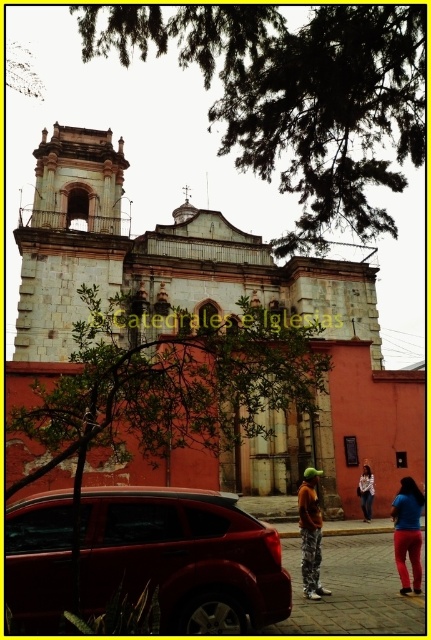
Is smooth stone church at center smaller than orange fabric pants at center?

Incorrect, smooth stone church at center is not smaller in size than orange fabric pants at center.

Does point (315, 422) come farther from viewer compared to point (315, 538)?

Yes, point (315, 422) is farther from viewer.

Is point (162, 305) behind point (299, 493)?

Yes.

Where is `smooth stone church at center`? smooth stone church at center is located at coordinates (208, 316).

Who is lower down, green leafy tree at upper center or green leafy tree at center?

green leafy tree at center is below.

Is green leafy tree at upper center positioned in front of green leafy tree at center?

No, green leafy tree at upper center is further to the viewer.

Is point (249, 122) behind point (246, 582)?

Yes, it is.

Locate an element on the screen. Image resolution: width=431 pixels, height=640 pixels. green leafy tree at upper center is located at coordinates (296, 96).

Which is above, smooth stone church at center or shiny red suv at lower left?

Positioned higher is smooth stone church at center.

Is smooth stone church at center to the left of shiny red suv at lower left from the viewer's perspective?

In fact, smooth stone church at center is to the right of shiny red suv at lower left.

Does point (84, 257) come farther from viewer compared to point (140, 584)?

Yes, point (84, 257) is farther from viewer.

Locate an element on the screen. This screenshot has width=431, height=640. smooth stone church at center is located at coordinates (208, 316).